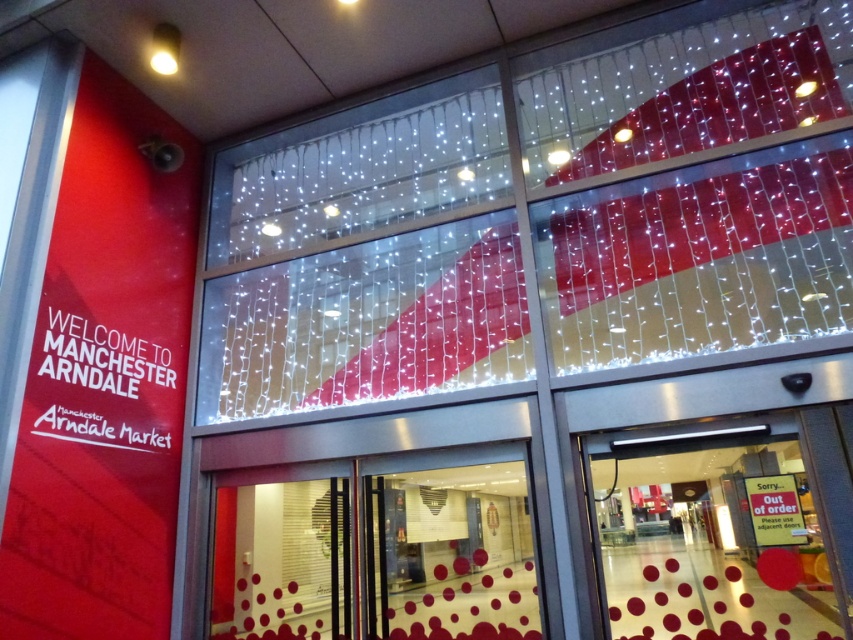
You are standing at the entrance of Manchester Arndale and want to locate the white string lights at upper center. According to the coordinates provided, where exactly are they positioned?

The white string lights at upper center are located at point (543, 218).

You are a visitor at Manchester Arndale and want to take a photo of the entrance. You notice the white string lights at upper center and the red plastic sign at lower right. Which object should you focus on if you want to capture the larger one in your shot?

The white string lights at upper center is larger in size than the red plastic sign at lower right, so you should focus on the white string lights at upper center to capture the larger one in your shot.

You are a delivery person carrying a large package that is 3 feet wide. You need to enter Manchester Arndale through the entrance shown. Can you fit through the space between the metallic glass door at center and the transparent glass door at lower right?

The metallic glass door at center and transparent glass door at lower right are 3.45 feet apart. Since your package is 3 feet wide, it should fit through the space between them as 3.45 feet is wider than 3 feet.